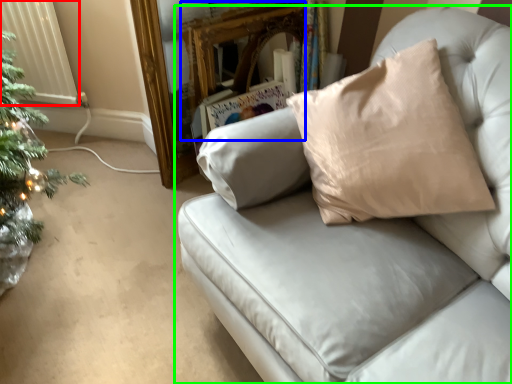
Question: Which object is positioned closest to radiator (highlighted by a red box)? Select from mirror (highlighted by a blue box) and studio couch (highlighted by a green box).

Choices:
 (A) mirror
 (B) studio couch

Answer: (A)